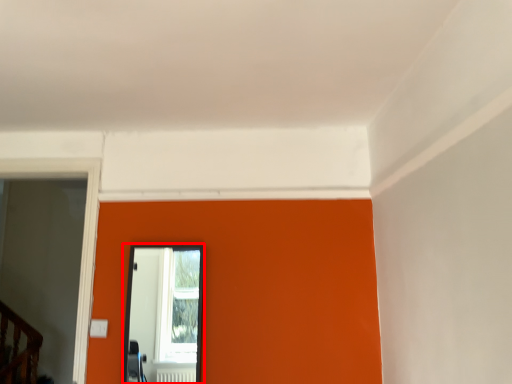
Question: Considering the relative positions of mirror (annotated by the red box) and glass door in the image provided, where is mirror (annotated by the red box) located with respect to the staircase?

Choices:
 (A) right
 (B) left

Answer: (A)